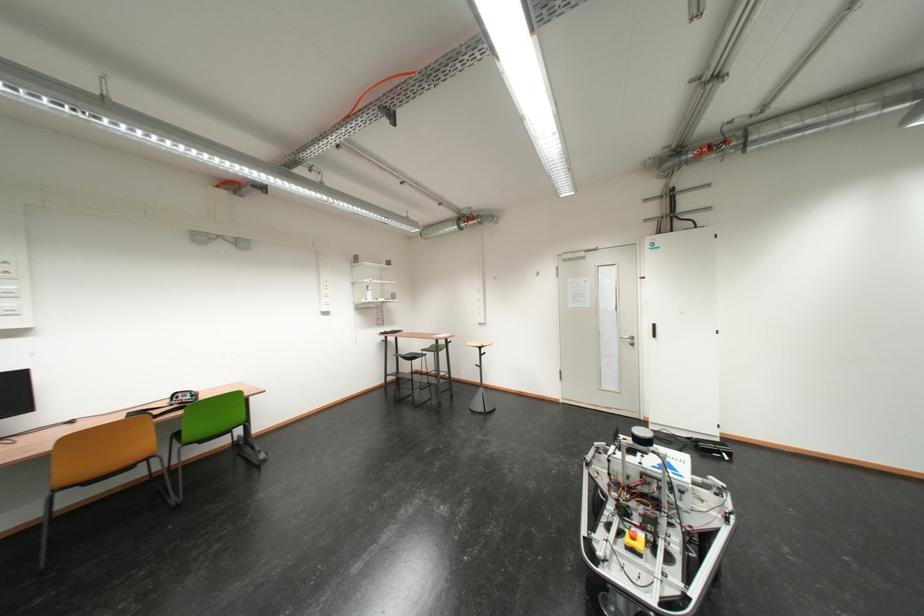
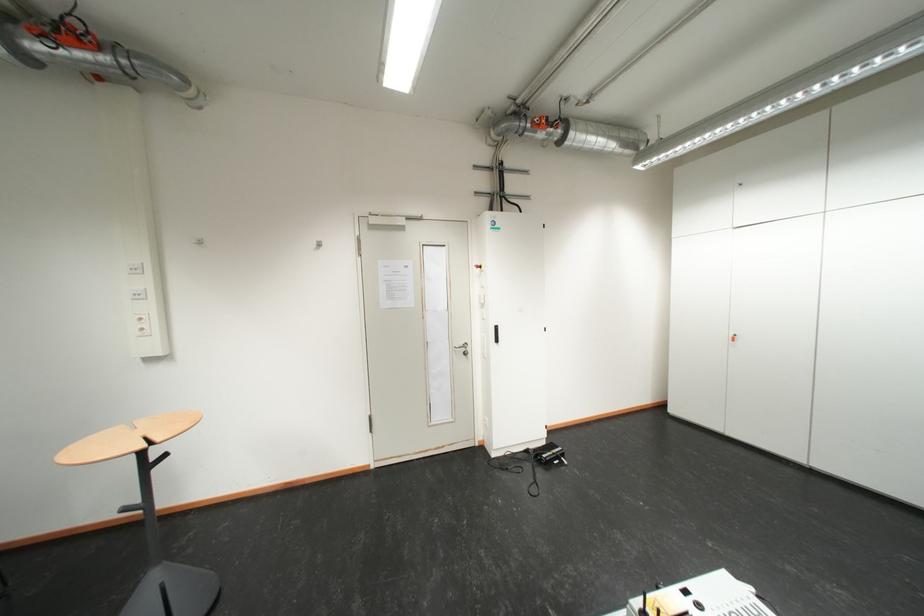
Where in the second image is the point corresponding to the point at 472,231 from the first image?

(35, 60)